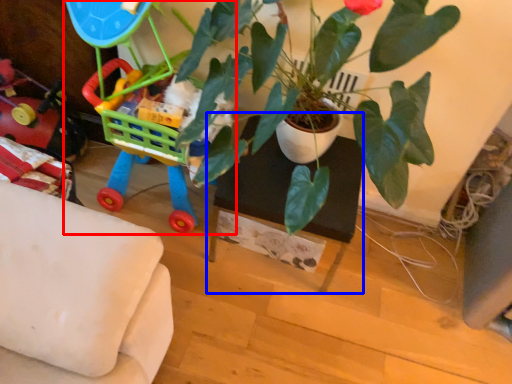
Question: Among these objects, which one is nearest to the camera, toy (highlighted by a red box) or table (highlighted by a blue box)?

Choices:
 (A) toy
 (B) table

Answer: (A)